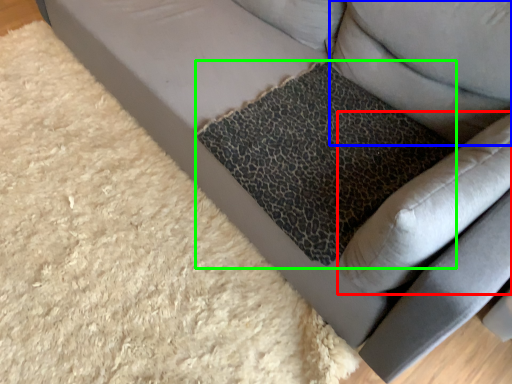
Question: Considering the real-world distances, which object is closest to swivel chair (highlighted by a red box)? pillow (highlighted by a blue box) or cat bed (highlighted by a green box).

Choices:
 (A) pillow
 (B) cat bed

Answer: (B)